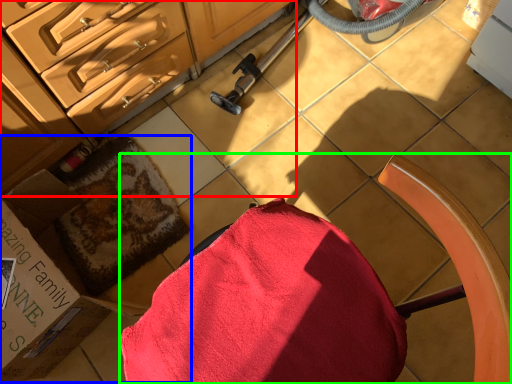
Question: Which object is positioned closest to cabinetry (highlighted by a red box)? Select from box (highlighted by a blue box) and chair (highlighted by a green box).

Choices:
 (A) box
 (B) chair

Answer: (A)